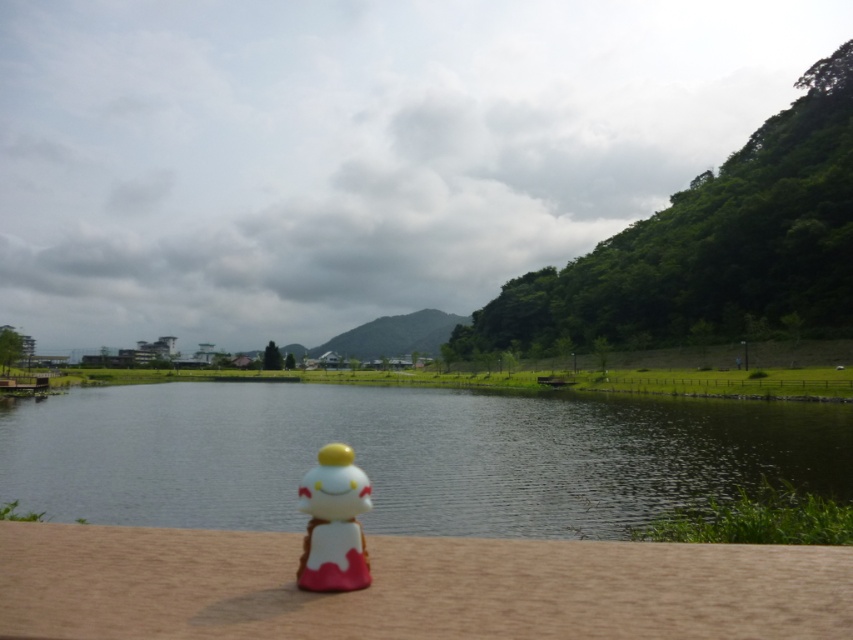
Question: Is transparent water at lake center thinner than matte plastic figurine at center?

Choices:
 (A) yes
 (B) no

Answer: (B)

Question: Which object appears farthest from the camera in this image?

Choices:
 (A) matte plastic figurine at center
 (B) transparent water at lake center

Answer: (B)

Question: Which point is farther to the camera?

Choices:
 (A) transparent water at lake center
 (B) matte plastic figurine at center

Answer: (A)

Question: Where is transparent water at lake center located in relation to matte plastic figurine at center in the image?

Choices:
 (A) right
 (B) left

Answer: (B)

Question: Can you confirm if transparent water at lake center is thinner than matte plastic figurine at center?

Choices:
 (A) no
 (B) yes

Answer: (A)